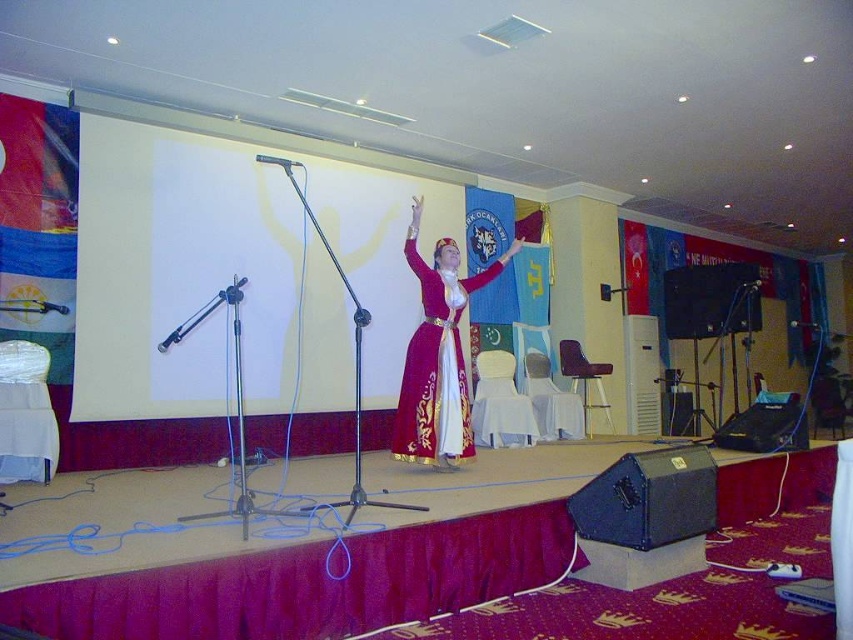
Is point (48, 305) positioned behind point (811, 324)?

No, it is not.

Is point (51, 301) less distant than point (790, 323)?

Yes, it is.

Where is `metallic silver microphone at left`? Image resolution: width=853 pixels, height=640 pixels. metallic silver microphone at left is located at coordinates (51, 307).

Between point (445, 420) and point (62, 310), which one is positioned behind?

The point (62, 310) is more distant.

Consider the image. Who is taller, velvet maroon dress at center or metallic silver microphone at left?

Standing taller between the two is velvet maroon dress at center.

Who is more distant from viewer, (436, 268) or (62, 307)?

The point (62, 307) is more distant.

Find the location of a particular element. The width and height of the screenshot is (853, 640). velvet maroon dress at center is located at coordinates (437, 355).

Between velvet maroon dress at center and black metallic microphone at center, which one has less height?

Standing shorter between the two is black metallic microphone at center.

Between velvet maroon dress at center and black metallic microphone at center, which one appears on the left side from the viewer's perspective?

From the viewer's perspective, velvet maroon dress at center appears more on the left side.

Which is behind, point (454, 440) or point (816, 326)?

The point (816, 326) is behind.

Identify the location of velvet maroon dress at center. The width and height of the screenshot is (853, 640). (437, 355).